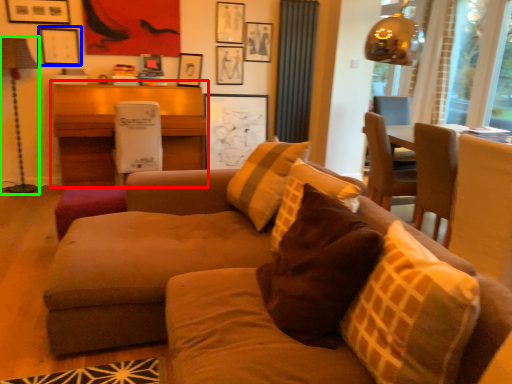
Question: Based on their relative distances, which object is nearer to table (highlighted by a red box)? Choose from picture frame (highlighted by a blue box) and lamp (highlighted by a green box).

Choices:
 (A) picture frame
 (B) lamp

Answer: (A)